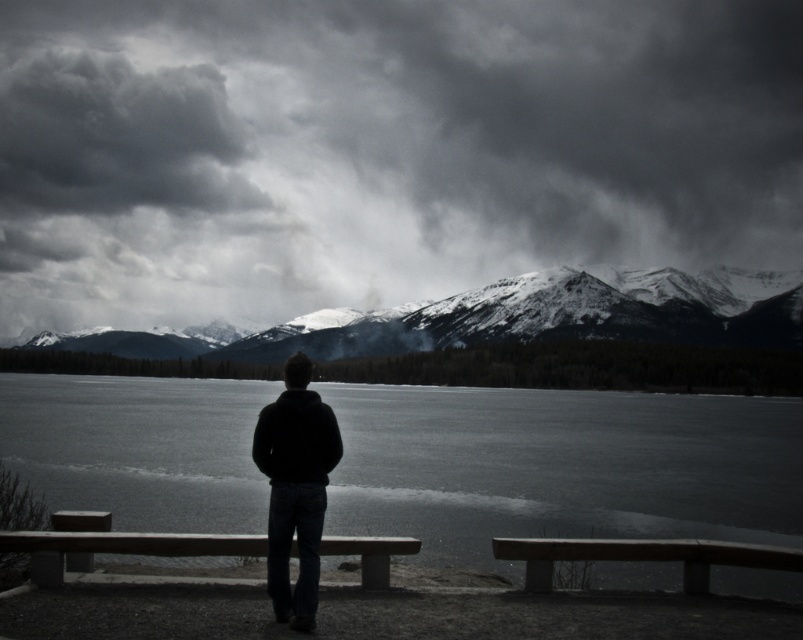
Question: Is black matte jacket at center positioned in front of wooden bench at center?

Choices:
 (A) no
 (B) yes

Answer: (B)

Question: Estimate the real-world distances between objects in this image. Which object is farther from the black matte jacket at center?

Choices:
 (A) wooden bench at lower center
 (B) wooden bench at center

Answer: (A)

Question: Which of these objects is positioned closest to the dark gray fluffy cloud at upper left?

Choices:
 (A) wooden bench at lower center
 (B) black matte jacket at center

Answer: (A)

Question: Which object is positioned closest to the dark gray fluffy cloud at upper left?

Choices:
 (A) black matte jacket at center
 (B) wooden bench at lower center

Answer: (B)

Question: Can you confirm if cloudy sky at upper center is positioned to the left of dark gray fluffy cloud at upper left?

Choices:
 (A) yes
 (B) no

Answer: (B)

Question: From the image, what is the correct spatial relationship of black matte jacket at center in relation to wooden bench at lower center?

Choices:
 (A) below
 (B) above

Answer: (B)